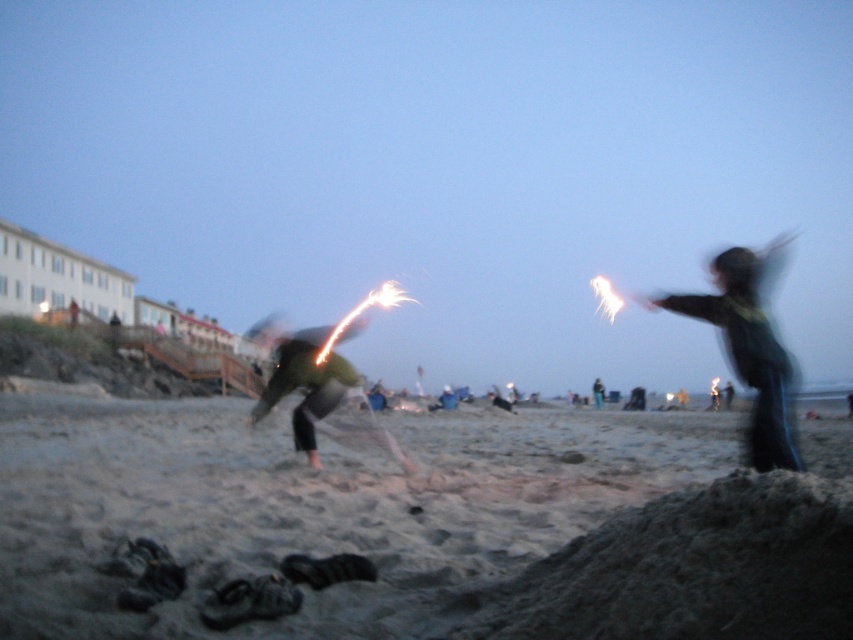
You are standing at the origin point in the beach scene. Which of the two points, point (722,317) or point (595,380), is closer to you?

Point (722,317) is in front of point (595,380), so it is closer to you.

You are a photographer trying to capture the entire scene of the beach at twilight. You notice two items in the image labeled as dark green fabric at right and green fabric jacket at center. Which of these items would require you to zoom out more to include them fully in your photo?

The dark green fabric at right occupies less space than the green fabric jacket at center, so you would need to zoom out more to include the larger green fabric jacket at center in the photo.